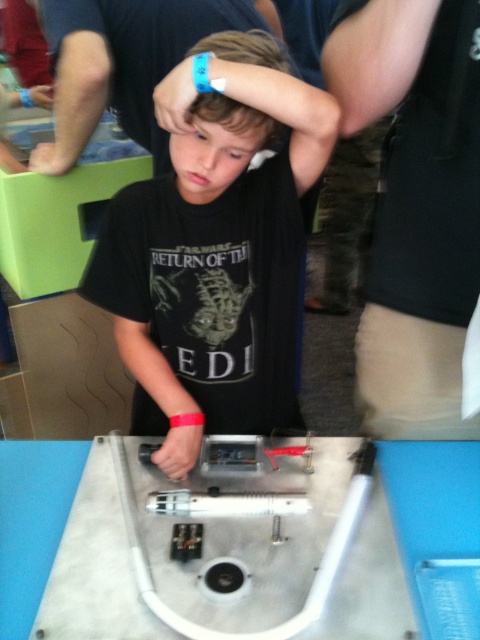
Question: Can you confirm if black matte shirt at center is positioned to the right of silver metallic lightsaber at center?

Choices:
 (A) yes
 (B) no

Answer: (B)

Question: Does matte black head at upper center have a smaller size compared to silver metallic lightsaber at center?

Choices:
 (A) no
 (B) yes

Answer: (B)

Question: Which point is farther to the camera?

Choices:
 (A) (196, 122)
 (B) (211, 134)
 (C) (140, 561)

Answer: (B)

Question: Which of the following is the farthest from the observer?

Choices:
 (A) matte black head at upper center
 (B) blue wristband at upper center

Answer: (B)

Question: Does matte black head at upper center lie in front of silver metallic lightsaber at center?

Choices:
 (A) no
 (B) yes

Answer: (A)

Question: Estimate the real-world distances between objects in this image. Which object is closer to the matte black head at upper center?

Choices:
 (A) silver metallic lightsaber at center
 (B) blue wristband at upper center
 (C) black matte shirt at center

Answer: (C)